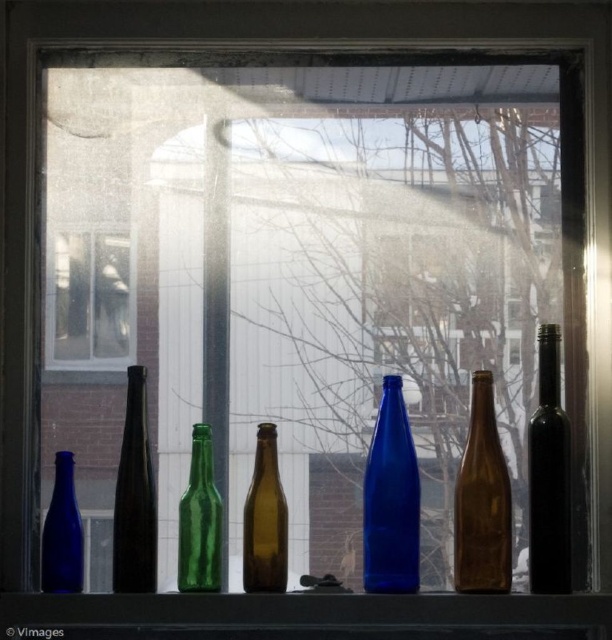
Who is higher up, matte glass bottles at center or matte blue glass bottle at center?

matte blue glass bottle at center

Can you confirm if matte glass bottles at center is thinner than matte blue glass bottle at center?

Incorrect, matte glass bottles at center's width is not less than matte blue glass bottle at center's.

The width and height of the screenshot is (612, 640). What do you see at coordinates (304, 616) in the screenshot?
I see `matte glass bottles at center` at bounding box center [304, 616].

Locate an element on the screen. This screenshot has height=640, width=612. matte glass bottles at center is located at coordinates (304, 616).

Is black glass bottle at right thinner than green glass bottle at center?

No.

Who is taller, black glass bottle at right or green glass bottle at center?

Standing taller between the two is black glass bottle at right.

Image resolution: width=612 pixels, height=640 pixels. I want to click on black glass bottle at right, so click(548, 474).

In order to click on black glass bottle at right in this screenshot , I will do `click(548, 474)`.

The width and height of the screenshot is (612, 640). What do you see at coordinates (304, 616) in the screenshot?
I see `matte glass bottles at center` at bounding box center [304, 616].

Is matte glass bottles at center wider than green glass bottle at center?

Yes, matte glass bottles at center is wider than green glass bottle at center.

Which is behind, point (237, 632) or point (211, 470)?

The point (211, 470) is behind.

This screenshot has width=612, height=640. In order to click on matte glass bottles at center in this screenshot , I will do `click(304, 616)`.